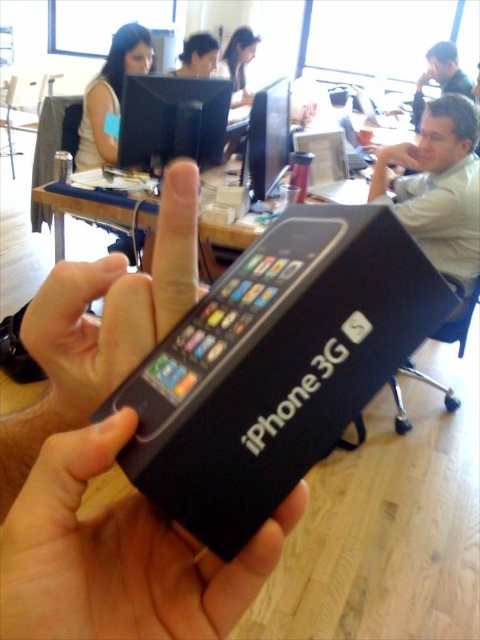
Is light brown hair at upper right bigger than smooth skin face at upper center?

Indeed, light brown hair at upper right has a larger size compared to smooth skin face at upper center.

I want to click on light brown hair at upper right, so click(x=440, y=76).

Does point (442, 54) come closer to viewer compared to point (237, 81)?

That is False.

You are a GUI agent. You are given a task and a screenshot of the screen. Output one action in this format:
    pyautogui.click(x=<x>, y=<y>)
    Task: Click on the light brown hair at upper right
    
    Given the screenshot: What is the action you would take?
    pyautogui.click(x=440, y=76)

Where is `light brown hair at upper right`? Image resolution: width=480 pixels, height=640 pixels. light brown hair at upper right is located at coordinates (440, 76).

Does point (455, 49) come behind point (210, 36)?

That is True.

The width and height of the screenshot is (480, 640). Find the location of `light brown hair at upper right`. light brown hair at upper right is located at coordinates (440, 76).

Who is higher up, black matte iphone at center or light brown hair at upper right?

light brown hair at upper right

This screenshot has height=640, width=480. Find the location of `black matte iphone at center`. black matte iphone at center is located at coordinates (119, 554).